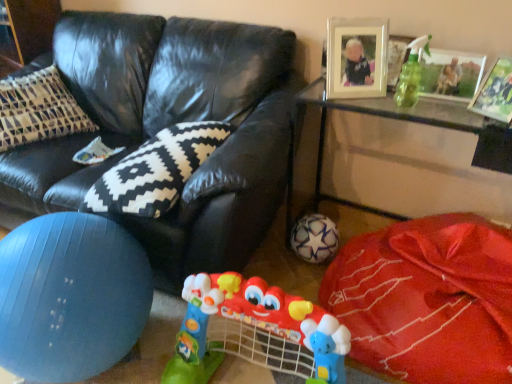
Question: From a real-world perspective, is black leather couch at center on top of metallic silver picture frame at upper right, which appears as the second picture frame when viewed from the right?

Choices:
 (A) no
 (B) yes

Answer: (A)

Question: Can you confirm if black leather couch at center is shorter than metallic silver picture frame at upper right, the second picture frame viewed from the left?

Choices:
 (A) yes
 (B) no

Answer: (B)

Question: From a real-world perspective, is black leather couch at center physically below metallic silver picture frame at upper right, which appears as the second picture frame when viewed from the right?

Choices:
 (A) no
 (B) yes

Answer: (B)

Question: Considering the relative sizes of black leather couch at center and metallic silver picture frame at upper right, which appears as the second picture frame when viewed from the right, in the image provided, is black leather couch at center smaller than metallic silver picture frame at upper right, which appears as the second picture frame when viewed from the right,?

Choices:
 (A) no
 (B) yes

Answer: (A)

Question: Is metallic silver picture frame at upper right, which appears as the second picture frame when viewed from the right, inside black leather couch at center?

Choices:
 (A) yes
 (B) no

Answer: (B)

Question: Looking at the image, does white star-patterned ball at lower center seem bigger or smaller compared to transparent glass table at lower right?

Choices:
 (A) small
 (B) big

Answer: (A)

Question: Considering the positions of point (323, 258) and point (496, 132), is point (323, 258) closer or farther from the camera than point (496, 132)?

Choices:
 (A) closer
 (B) farther

Answer: (B)

Question: From the image's perspective, is white star-patterned ball at lower center above or below transparent glass table at lower right?

Choices:
 (A) above
 (B) below

Answer: (B)

Question: From a real-world perspective, relative to transparent glass table at lower right, is white star-patterned ball at lower center vertically above or below?

Choices:
 (A) above
 (B) below

Answer: (B)

Question: Would you say metallic silver picture frame at upper right, which appears as the second picture frame when viewed from the right, is to the left or to the right of black and white zigzag pillow at center in the picture?

Choices:
 (A) right
 (B) left

Answer: (A)

Question: Considering the positions of point (436, 79) and point (178, 152), is point (436, 79) closer or farther from the camera than point (178, 152)?

Choices:
 (A) farther
 (B) closer

Answer: (A)

Question: From a real-world perspective, is metallic silver picture frame at upper right, the second picture frame viewed from the left, physically located above or below black and white zigzag pillow at center?

Choices:
 (A) below
 (B) above

Answer: (B)

Question: In the image, is metallic silver picture frame at upper right, the second picture frame viewed from the left, positioned in front of or behind black and white zigzag pillow at center?

Choices:
 (A) behind
 (B) front

Answer: (A)

Question: From a real-world perspective, is black and white zigzag pillow at center physically located above or below white textured ball at lower center?

Choices:
 (A) below
 (B) above

Answer: (B)

Question: Based on their sizes in the image, would you say black and white zigzag pillow at center is bigger or smaller than white textured ball at lower center?

Choices:
 (A) small
 (B) big

Answer: (A)